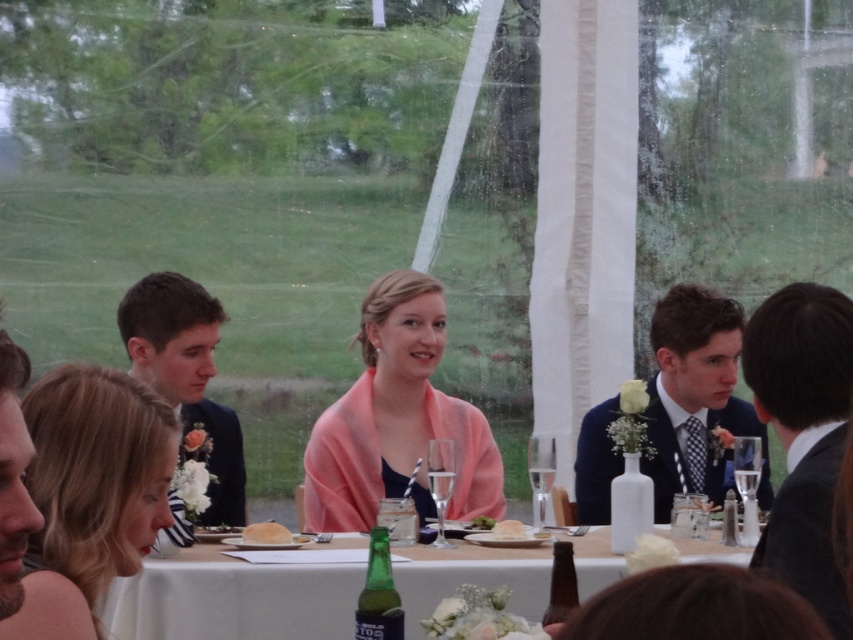
You are a photographer at a formal event and need to decide which suit to focus on for a closeup. Since the dark gray suit at right is narrower than the dark blue suit at left, which one should you choose to ensure the entire suit fits within the camera frame without cropping?

The dark gray suit at right has a smaller width compared to the dark blue suit at left, so choosing the dark gray suit at right would ensure it fits within the camera frame without cropping.

You are a photographer at the event and need to position yourself to capture a photo of the dark gray suit at right without including the green bottle in the foreground. Based on their positions, can you stand to the left or right of the table to achieve this?

The dark gray suit at right is located at point (x=804, y=435). Since the green bottle is in the foreground and the dark gray suit is positioned further back, standing to the right of the table would allow you to frame the photo to exclude the green bottle while focusing on the dark gray suit at right.

You are a photographer at a formal event. You need to capture a photo that includes both the blue suit at center and the dark blue suit at left. Based on their positions, which suit is closer to the camera?

The blue suit at center is closer to the camera because it is positioned below the dark blue suit at left, indicating it is in a lower plane and thus nearer to the viewer.